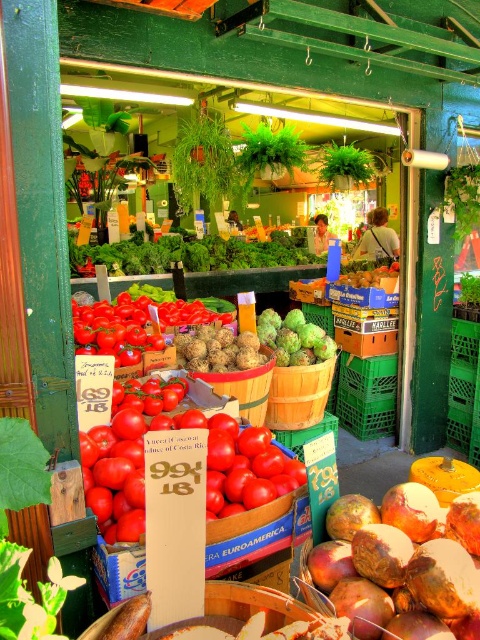
Can you confirm if green leafy at center is taller than green matte pineapple at center?

Correct, green leafy at center is much taller as green matte pineapple at center.

At what (x,y) coordinates should I click in order to perform the action: click on green leafy at center. Please return your answer as a coordinate pair (x, y). The height and width of the screenshot is (640, 480). Looking at the image, I should click on point(184,253).

Can you confirm if rustic brown root at center is shorter than green leafy at center?

Indeed, rustic brown root at center has a lesser height compared to green leafy at center.

Measure the distance between point (325, 579) and camera.

Point (325, 579) is 4.99 feet from camera.

Find the location of a particular element. The width and height of the screenshot is (480, 640). rustic brown root at center is located at coordinates (403, 564).

Is point (364, 595) positioned before point (291, 333)?

Yes, point (364, 595) is closer to viewer.

From the picture: Does rustic brown root at center appear under green matte pineapple at center?

Yes, rustic brown root at center is below green matte pineapple at center.

Which is behind, point (410, 637) or point (287, 337)?

Positioned behind is point (287, 337).

Locate an element on the screen. The height and width of the screenshot is (640, 480). rustic brown root at center is located at coordinates (403, 564).